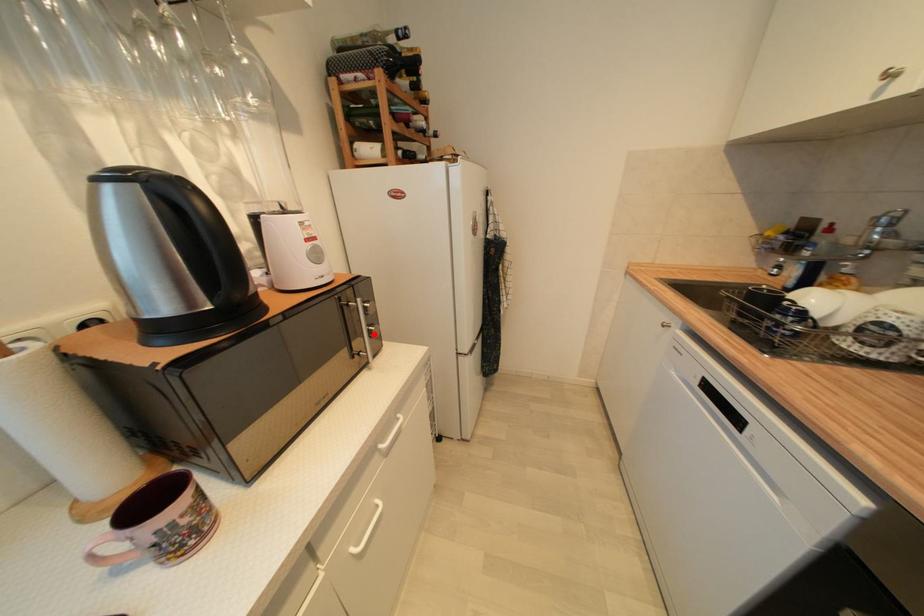
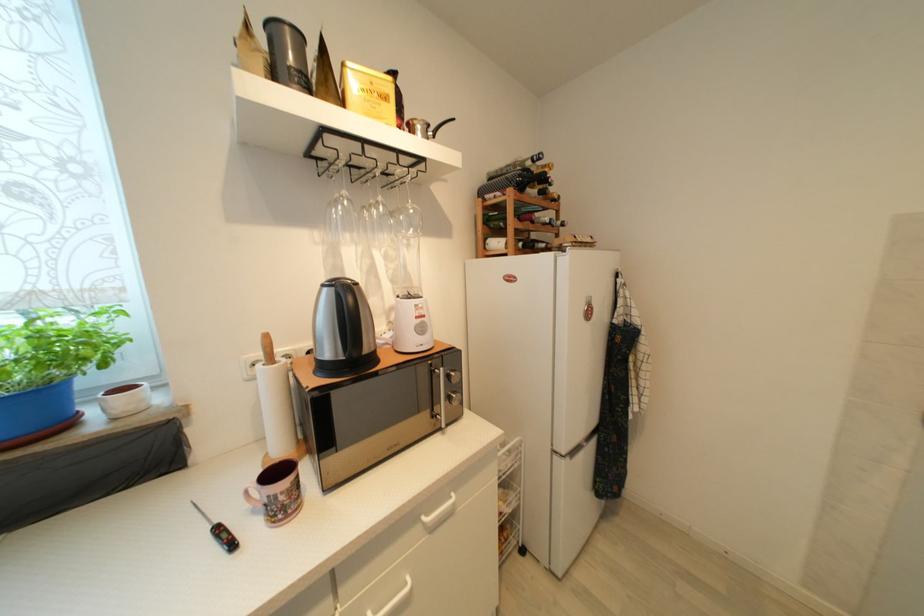
Find the pixel in the second image that matches the highlighted location in the first image.

(455, 400)